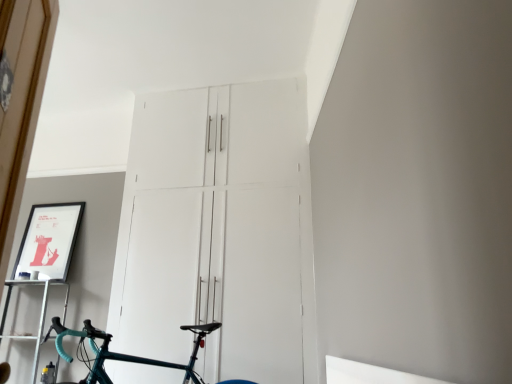
Measure the distance between teal glossy bicycle at center and camera.

7.53 feet.

What is the approximate width of teal glossy bicycle at center?

It is 1.75 meters.

Image resolution: width=512 pixels, height=384 pixels. I want to click on metallic silver shelf at lower left, so click(x=40, y=315).

Where is `teal glossy bicycle at center`? This screenshot has width=512, height=384. teal glossy bicycle at center is located at coordinates (125, 354).

From a real-world perspective, is matte black picture frame at upper left positioned under teal glossy bicycle at center based on gravity?

Incorrect, from a real-world perspective, matte black picture frame at upper left is higher than teal glossy bicycle at center.

Considering the relative sizes of matte black picture frame at upper left and teal glossy bicycle at center in the image provided, is matte black picture frame at upper left taller than teal glossy bicycle at center?

Yes, matte black picture frame at upper left is taller than teal glossy bicycle at center.

Considering the relative positions of matte black picture frame at upper left and teal glossy bicycle at center in the image provided, is matte black picture frame at upper left to the left or to the right of teal glossy bicycle at center?

matte black picture frame at upper left is positioned on teal glossy bicycle at center's left side.

Is teal glossy bicycle at center at the back of matte black picture frame at upper left?

No, teal glossy bicycle at center is not at the back of matte black picture frame at upper left.

Consider the image. How many degrees apart are the facing directions of matte black picture frame at upper left and metallic silver shelf at lower left?

The angle between the facing direction of matte black picture frame at upper left and the facing direction of metallic silver shelf at lower left is 0.000143 degrees.

Considering the positions of objects matte black picture frame at upper left and metallic silver shelf at lower left in the image provided, who is in front, matte black picture frame at upper left or metallic silver shelf at lower left?

metallic silver shelf at lower left.

Find the location of a particular element. The width and height of the screenshot is (512, 384). shelf in front of the matte black picture frame at upper left is located at coordinates (40, 315).

Based on their sizes in the image, would you say metallic silver shelf at lower left is bigger or smaller than white matte cabinet at center?

Clearly, metallic silver shelf at lower left is smaller in size than white matte cabinet at center.

Considering the relative sizes of metallic silver shelf at lower left and white matte cabinet at center in the image provided, is metallic silver shelf at lower left taller than white matte cabinet at center?

Incorrect, the height of metallic silver shelf at lower left is not larger of that of white matte cabinet at center.

Between point (4, 306) and point (272, 302), which one is positioned behind?

Point (4, 306)

Looking at this image, from a real-world perspective, between teal glossy bicycle at center and metallic silver shelf at lower left, who is vertically higher?

metallic silver shelf at lower left.

From the image's perspective, which object appears higher, teal glossy bicycle at center or metallic silver shelf at lower left?

teal glossy bicycle at center, from the image's perspective.

Which is more to the left, teal glossy bicycle at center or metallic silver shelf at lower left?

metallic silver shelf at lower left.

At what (x,y) coordinates should I click in order to perform the action: click on door above the teal glossy bicycle at center (from the image's perspective). Please return your answer as a coordinate pair (x, y). Looking at the image, I should click on (216, 228).

From a real-world perspective, is teal glossy bicycle at center above or below white matte cabinet at center?

From a real-world perspective, teal glossy bicycle at center is physically below white matte cabinet at center.

Are teal glossy bicycle at center and white matte cabinet at center far apart?

Actually, teal glossy bicycle at center and white matte cabinet at center are a little close together.

Which point is more forward, (84,320) or (187,174)?

The point (84,320) is in front.

Does point (30, 218) come closer to viewer compared to point (138, 201)?

No.

Is the position of matte black picture frame at upper left more distant than that of white matte cabinet at center?

Yes, matte black picture frame at upper left is behind white matte cabinet at center.

From a real-world perspective, does matte black picture frame at upper left stand above white matte cabinet at center?

No, from a real-world perspective, matte black picture frame at upper left is not on top of white matte cabinet at center.

Is matte black picture frame at upper left shorter than white matte cabinet at center?

Yes, matte black picture frame at upper left is shorter than white matte cabinet at center.

Is white matte cabinet at center to the right of metallic silver shelf at lower left from the viewer's perspective?

Yes.

Consider the image. Is white matte cabinet at center facing away from metallic silver shelf at lower left?

No.

Considering the relative sizes of white matte cabinet at center and metallic silver shelf at lower left in the image provided, is white matte cabinet at center wider than metallic silver shelf at lower left?

Incorrect, the width of white matte cabinet at center does not surpass that of metallic silver shelf at lower left.

Where is `bicycle below the matte black picture frame at upper left (from the image's perspective)`? The image size is (512, 384). bicycle below the matte black picture frame at upper left (from the image's perspective) is located at coordinates (125, 354).

You are a GUI agent. You are given a task and a screenshot of the screen. Output one action in this format:
    pyautogui.click(x=<x>, y=<y>)
    Task: Click on the picture frame above the metallic silver shelf at lower left (from the image's perspective)
    This screenshot has height=384, width=512.
    Given the screenshot: What is the action you would take?
    pyautogui.click(x=49, y=240)

When comparing their distances from teal glossy bicycle at center, does white matte cabinet at center or matte black picture frame at upper left seem further?

Among the two, matte black picture frame at upper left is located further to teal glossy bicycle at center.

When comparing their distances from metallic silver shelf at lower left, does matte black picture frame at upper left or teal glossy bicycle at center seem closer?

matte black picture frame at upper left lies closer to metallic silver shelf at lower left than the other object.

Looking at the image, which one is located further to teal glossy bicycle at center, metallic silver shelf at lower left or white matte cabinet at center?

The object further to teal glossy bicycle at center is metallic silver shelf at lower left.

In the scene shown: Estimate the real-world distances between objects in this image. Which object is closer to teal glossy bicycle at center, matte black picture frame at upper left or metallic silver shelf at lower left?

The object closer to teal glossy bicycle at center is metallic silver shelf at lower left.

Considering their positions, is matte black picture frame at upper left positioned closer to white matte cabinet at center than metallic silver shelf at lower left?

Among the two, matte black picture frame at upper left is located nearer to white matte cabinet at center.

When comparing their distances from matte black picture frame at upper left, does metallic silver shelf at lower left or white matte cabinet at center seem further?

white matte cabinet at center.

Which object lies nearer to the anchor point metallic silver shelf at lower left, teal glossy bicycle at center or matte black picture frame at upper left?

A: matte black picture frame at upper left.

Based on their spatial positions, is metallic silver shelf at lower left or teal glossy bicycle at center closer to white matte cabinet at center?

Based on the image, teal glossy bicycle at center appears to be nearer to white matte cabinet at center.

The image size is (512, 384). Identify the location of bicycle between metallic silver shelf at lower left and white matte cabinet at center. (125, 354).

Find the location of a particular element. The image size is (512, 384). shelf between teal glossy bicycle at center and matte black picture frame at upper left along the z-axis is located at coordinates (40, 315).

This screenshot has height=384, width=512. In order to click on picture frame situated between metallic silver shelf at lower left and white matte cabinet at center from left to right in this screenshot , I will do `click(49, 240)`.

At what (x,y) coordinates should I click in order to perform the action: click on bicycle between matte black picture frame at upper left and white matte cabinet at center from left to right. Please return your answer as a coordinate pair (x, y). The image size is (512, 384). Looking at the image, I should click on (125, 354).